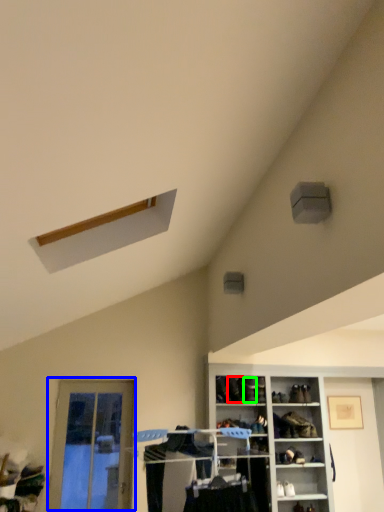
Question: Which object is the farthest from shoe (highlighted by a red box)? Choose among these: door (highlighted by a blue box) or shoe (highlighted by a green box).

Choices:
 (A) door
 (B) shoe

Answer: (A)